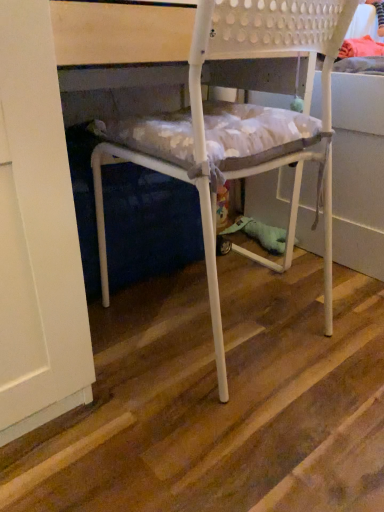
What are the coordinates of `free point above wooden at center (from a real-world perspective)` in the screenshot? It's located at (239, 334).